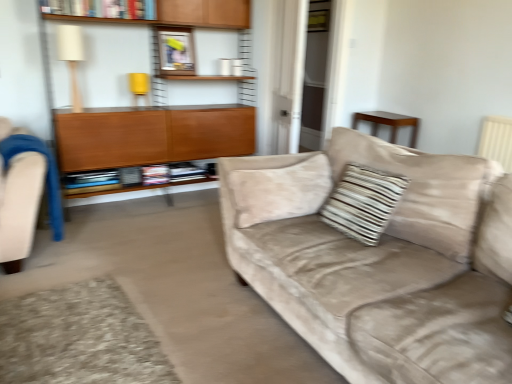
Question: Is white fabric lampshade at upper left positioned in front of hardcover book at upper center, positioned as the 2th book in bottom-to-top order?

Choices:
 (A) no
 (B) yes

Answer: (A)

Question: Can you confirm if white fabric lampshade at upper left is bigger than hardcover book at upper center, positioned as the 2th book in bottom-to-top order?

Choices:
 (A) yes
 (B) no

Answer: (B)

Question: Is white fabric lampshade at upper left looking in the opposite direction of hardcover book at upper center, positioned as the 2th book in bottom-to-top order?

Choices:
 (A) yes
 (B) no

Answer: (B)

Question: Is hardcover book at upper center, positioned as the 2th book in bottom-to-top order, inside white fabric lampshade at upper left?

Choices:
 (A) yes
 (B) no

Answer: (B)

Question: Is white fabric lampshade at upper left not inside hardcover book at upper center, which appears as the first book when viewed from the top?

Choices:
 (A) no
 (B) yes

Answer: (B)

Question: Considering the relative sizes of white fabric lampshade at upper left and hardcover book at upper center, positioned as the 2th book in bottom-to-top order, in the image provided, is white fabric lampshade at upper left smaller than hardcover book at upper center, positioned as the 2th book in bottom-to-top order,?

Choices:
 (A) yes
 (B) no

Answer: (A)

Question: From a real-world perspective, is blue fabric swivel chair at left positioned under suede beige couch at center based on gravity?

Choices:
 (A) no
 (B) yes

Answer: (B)

Question: Does blue fabric swivel chair at left come behind suede beige couch at center?

Choices:
 (A) no
 (B) yes

Answer: (B)

Question: Considering the relative sizes of blue fabric swivel chair at left and suede beige couch at center in the image provided, is blue fabric swivel chair at left shorter than suede beige couch at center?

Choices:
 (A) no
 (B) yes

Answer: (B)

Question: Is blue fabric swivel chair at left smaller than suede beige couch at center?

Choices:
 (A) no
 (B) yes

Answer: (B)

Question: Is blue fabric swivel chair at left to the right of suede beige couch at center from the viewer's perspective?

Choices:
 (A) yes
 (B) no

Answer: (B)

Question: Is blue fabric swivel chair at left looking in the opposite direction of suede beige couch at center?

Choices:
 (A) yes
 (B) no

Answer: (B)

Question: Can you confirm if suede beige couch at center is bigger than striped fabric pillow at center?

Choices:
 (A) yes
 (B) no

Answer: (A)